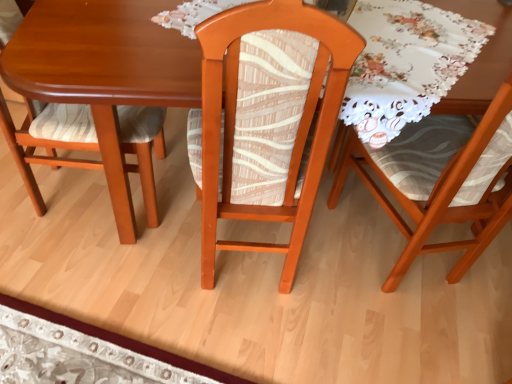
Question: Can you confirm if wooden table at center is wider than matte wood chair at left, the 1th chair in the left-to-right sequence?

Choices:
 (A) yes
 (B) no

Answer: (A)

Question: Is wooden table at center facing away from matte wood chair at left, the 1th chair in the left-to-right sequence?

Choices:
 (A) no
 (B) yes

Answer: (A)

Question: Is wooden table at center facing towards matte wood chair at left, positioned as the 3th chair in right-to-left order?

Choices:
 (A) no
 (B) yes

Answer: (A)

Question: From a real-world perspective, is wooden table at center beneath matte wood chair at left, the 1th chair in the left-to-right sequence?

Choices:
 (A) no
 (B) yes

Answer: (A)

Question: Considering the relative sizes of wooden table at center and matte wood chair at left, the 1th chair in the left-to-right sequence, in the image provided, is wooden table at center shorter than matte wood chair at left, the 1th chair in the left-to-right sequence,?

Choices:
 (A) yes
 (B) no

Answer: (A)

Question: From the image's perspective, is wooden chair at center, which appears as the second chair when viewed from the right, positioned above or below wooden table at center?

Choices:
 (A) below
 (B) above

Answer: (A)

Question: In terms of height, does wooden chair at center, marked as the second chair in a left-to-right arrangement, look taller or shorter compared to wooden table at center?

Choices:
 (A) tall
 (B) short

Answer: (A)

Question: In terms of width, does wooden chair at center, which appears as the second chair when viewed from the right, look wider or thinner when compared to wooden table at center?

Choices:
 (A) thin
 (B) wide

Answer: (A)

Question: Does point [x=212, y=26] appear closer or farther from the camera than point [x=128, y=205]?

Choices:
 (A) farther
 (B) closer

Answer: (B)

Question: Relative to wooden chair at center, which appears as the second chair when viewed from the right, is matte wood chair at left, the 1th chair in the left-to-right sequence, in front or behind?

Choices:
 (A) behind
 (B) front

Answer: (A)

Question: Does point (119, 144) appear closer or farther from the camera than point (247, 107)?

Choices:
 (A) closer
 (B) farther

Answer: (B)

Question: Looking at their shapes, would you say matte wood chair at left, the 1th chair in the left-to-right sequence, is wider or thinner than wooden chair at center, which appears as the second chair when viewed from the right?

Choices:
 (A) thin
 (B) wide

Answer: (B)

Question: From the image's perspective, relative to wooden chair at center, marked as the second chair in a left-to-right arrangement, is matte wood chair at left, positioned as the 3th chair in right-to-left order, above or below?

Choices:
 (A) above
 (B) below

Answer: (A)

Question: From a real-world perspective, is wooden table at center positioned above or below matte wood chair at left, positioned as the 3th chair in right-to-left order?

Choices:
 (A) above
 (B) below

Answer: (A)

Question: Is wooden table at center bigger or smaller than matte wood chair at left, the 1th chair in the left-to-right sequence?

Choices:
 (A) big
 (B) small

Answer: (B)